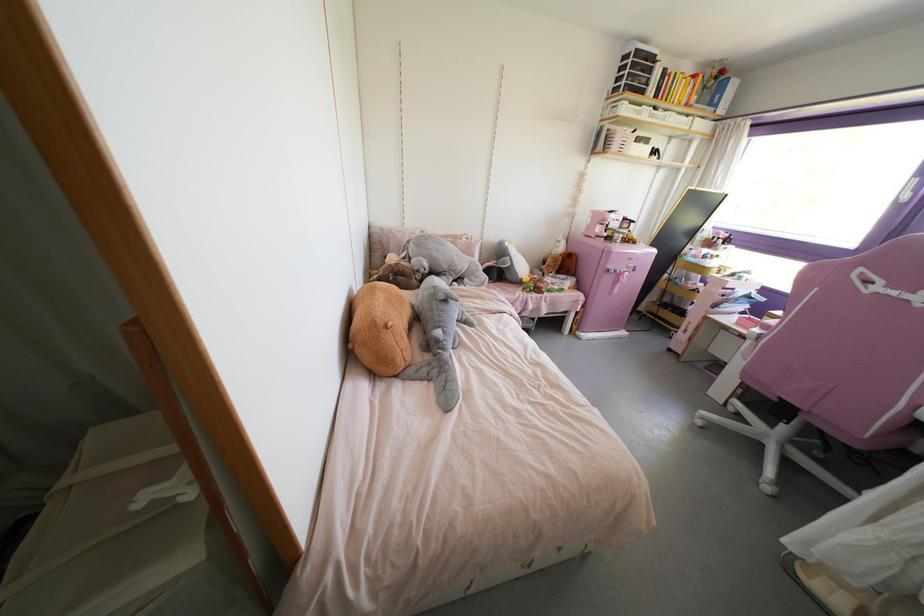
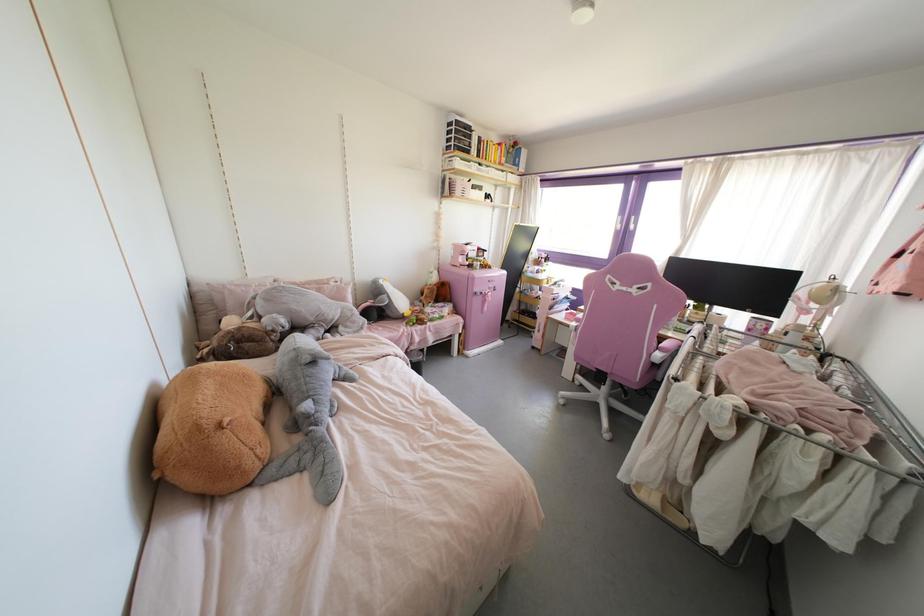
Question: The images are taken continuously from a first-person perspective. In which direction is your viewpoint rotating?

Choices:
 (A) Left
 (B) Right
 (C) Up
 (D) Down

Answer: (B)